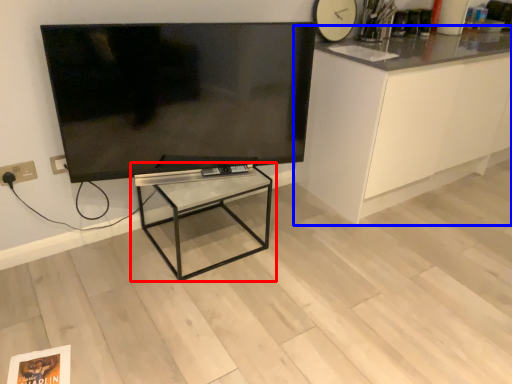
Question: Which of the following is the closest to the observer, table (highlighted by a red box) or cabinetry (highlighted by a blue box)?

Choices:
 (A) table
 (B) cabinetry

Answer: (A)